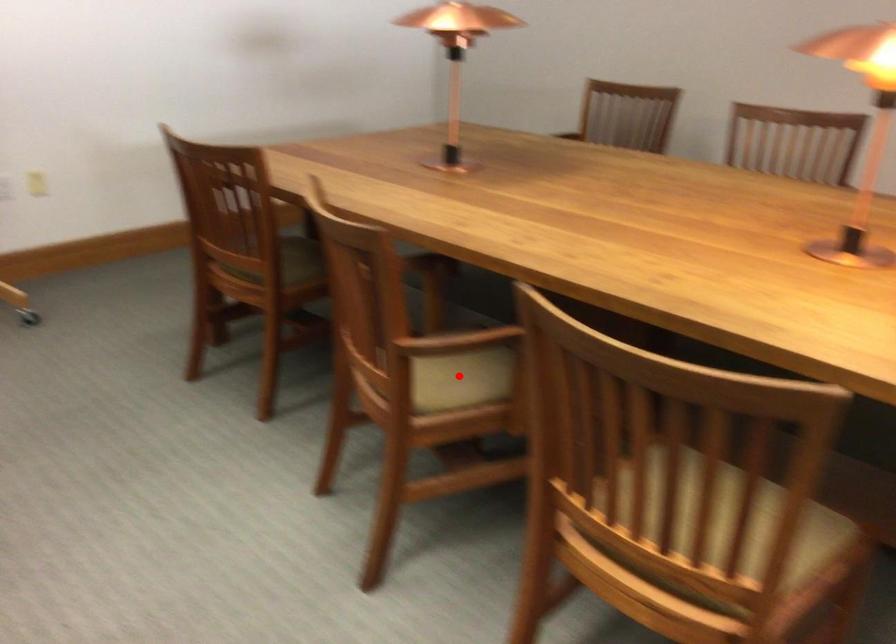
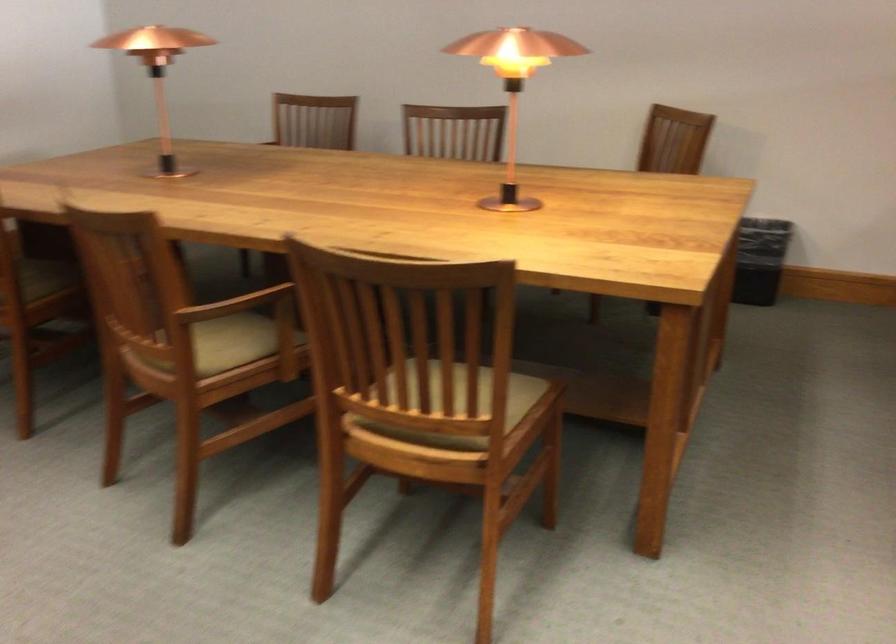
Question: I am providing you with two images of the same scene from different viewpoints. Image1 has a red point marked. In image2, the corresponding 3D location appears at what relative position? Reply with the corresponding letter.

Choices:
 (A) Closer
 (B) Farther

Answer: (B)